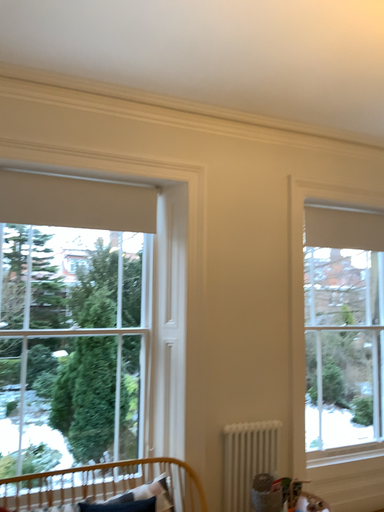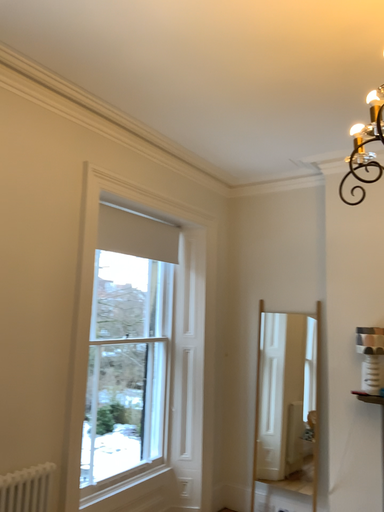
Question: Which way did the camera rotate in the video?

Choices:
 (A) rotated left
 (B) rotated right

Answer: (B)